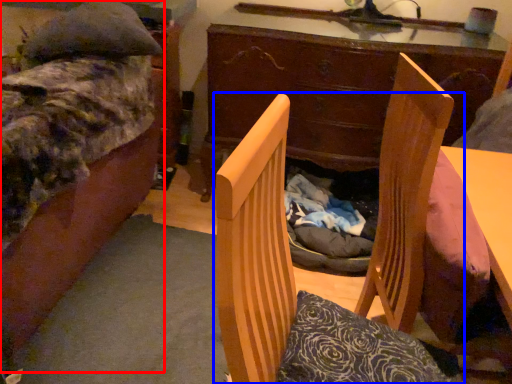
Question: Which object is closer to the camera taking this photo, bed (highlighted by a red box) or chair (highlighted by a blue box)?

Choices:
 (A) bed
 (B) chair

Answer: (B)